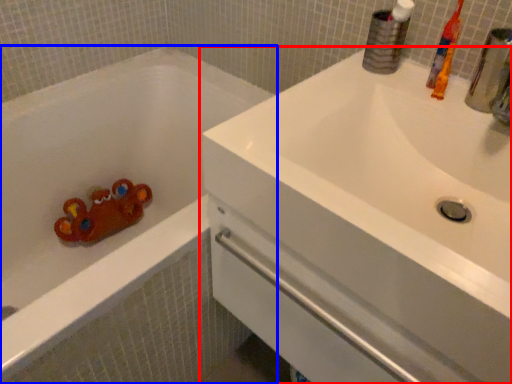
Question: Which object is further to the camera taking this photo, sink (highlighted by a red box) or bathtub (highlighted by a blue box)?

Choices:
 (A) sink
 (B) bathtub

Answer: (B)